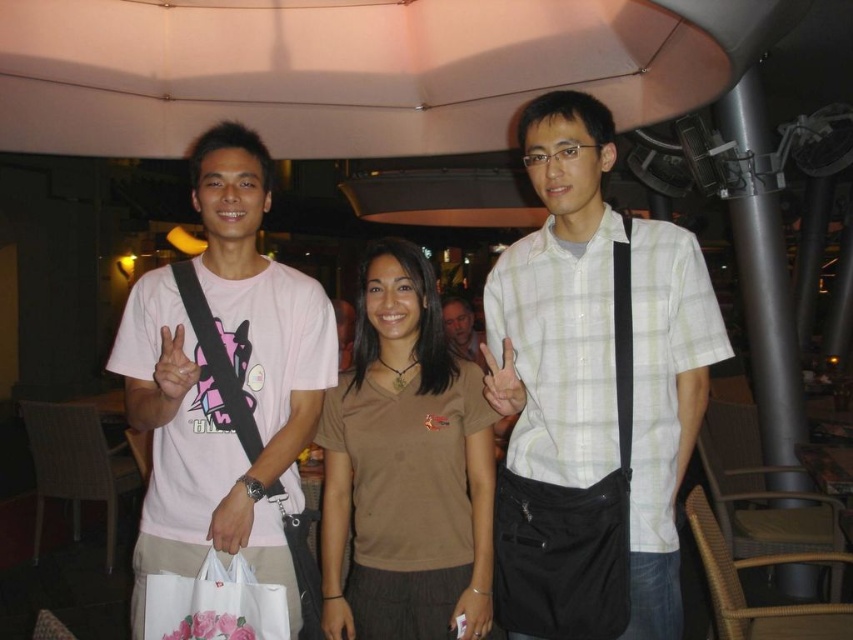
You are organizing a photo shoot and need to ensure that the white checkered shirt at center and the white plastic bag at lower center are visible in the final image. Based on their positions, which object is closer to the camera?

The white checkered shirt at center is closer to the camera because it is in front of the white plastic bag at lower center.

You are organizing a clothing donation drive and need to determine which item is wider between the white checkered shirt at center and the white plastic bag at lower center. Based on the scene, which item has a greater width?

The white checkered shirt at center has a greater width than the white plastic bag at lower center according to the description.